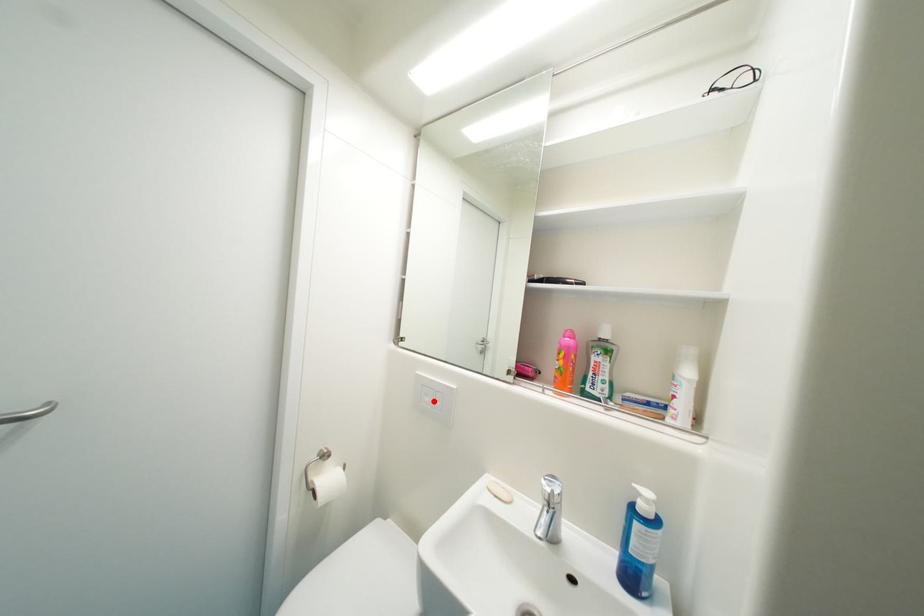
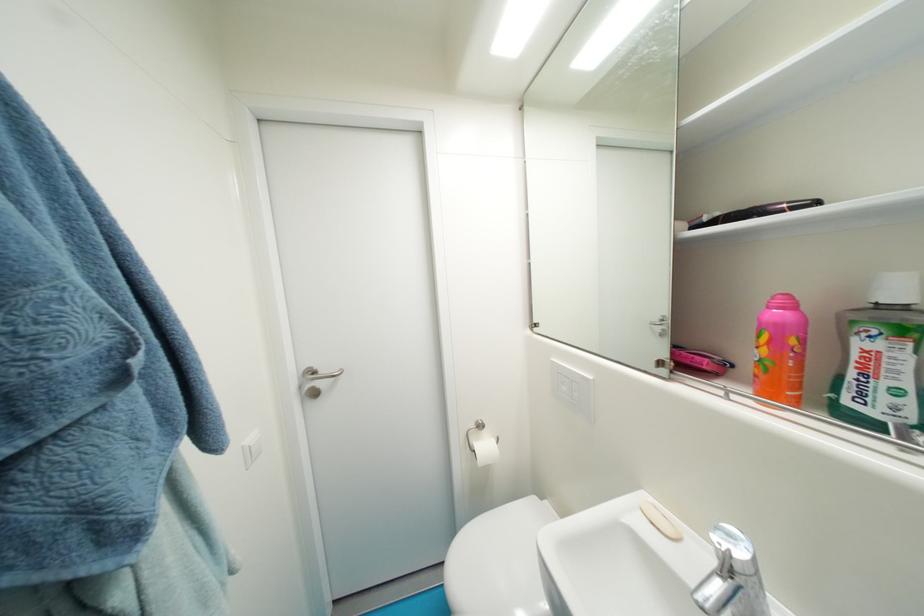
Locate, in the second image, the point that corresponds to the highlighted location in the first image.

(570, 390)